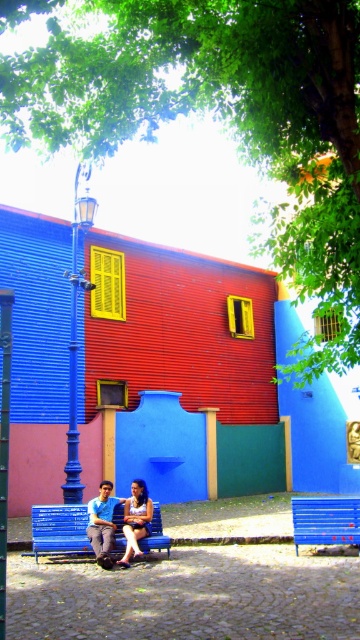
You are standing at the origin point of the image coordinate system. You see two points labeled as point (45, 522) and point (113, 531). Which point is closer to you?

Point (113, 531) is closer to you because it is in front of point (45, 522) according to the spatial relationship provided.

Based on the photo, you are standing on the cobblestone street in front of the colorful building. You see two points marked on the ground at coordinates point (72,426) and point (327,504). Which point is closer to the building?

Point (72,426) is behind point (327,504), so it is closer to the building.